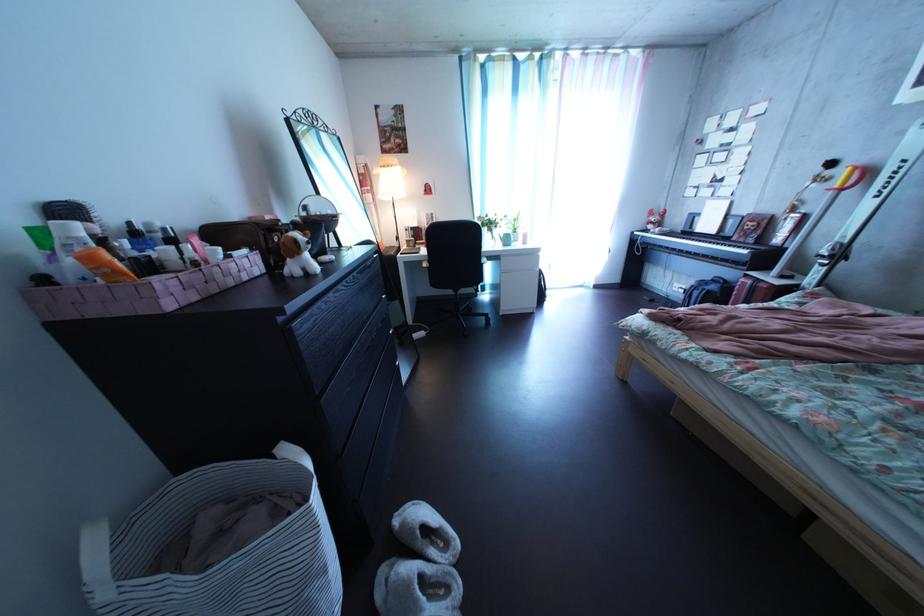
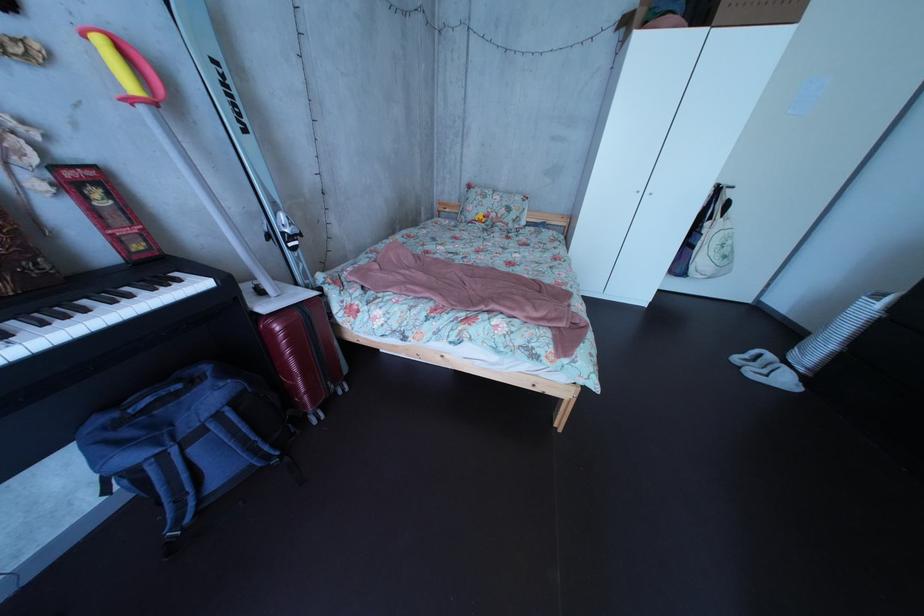
Locate, in the second image, the point that corresponds to point 766,290 in the first image.

(311, 322)